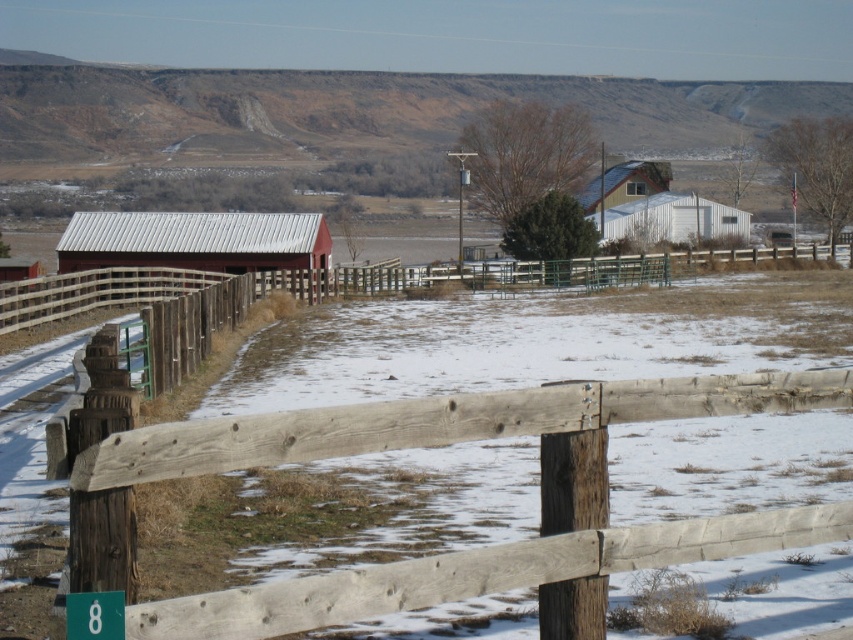
Question: Can you confirm if weathered wood fence at center is bigger than white corrugated metal barn at center?

Choices:
 (A) no
 (B) yes

Answer: (A)

Question: Is weathered wood fence at center smaller than metallic red barn at center?

Choices:
 (A) no
 (B) yes

Answer: (B)

Question: Which object is the farthest from the metallic red barn at center?

Choices:
 (A) white corrugated metal barn at center
 (B) weathered wood fence at center

Answer: (B)

Question: Which point appears farthest from the camera in this image?

Choices:
 (A) (x=712, y=228)
 (B) (x=704, y=540)
 (C) (x=114, y=241)

Answer: (A)

Question: Does weathered wood fence at center appear on the left side of white corrugated metal barn at center?

Choices:
 (A) yes
 (B) no

Answer: (A)

Question: Which of the following is the farthest from the observer?

Choices:
 (A) weathered wood fence at center
 (B) white corrugated metal barn at center

Answer: (B)